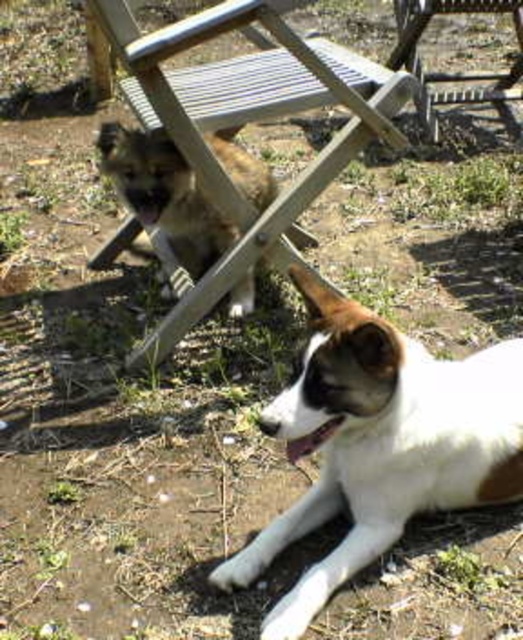
Which is behind, point (497, 445) or point (424, 128)?

The point (424, 128) is behind.

Locate an element on the screen. The height and width of the screenshot is (640, 523). white fur dog at lower right is located at coordinates (380, 444).

Who is more forward, [283,102] or [211,144]?

Positioned in front is point [283,102].

Which is above, wooden at upper center or brown fur dog at center?

Positioned higher is wooden at upper center.

Does point (132, 97) come closer to viewer compared to point (240, 298)?

Yes, point (132, 97) is in front of point (240, 298).

You are a GUI agent. You are given a task and a screenshot of the screen. Output one action in this format:
    pyautogui.click(x=<x>, y=<y>)
    Task: Click on the wooden at upper center
    
    Given the screenshot: What is the action you would take?
    (x=247, y=118)

Between white fur dog at lower right and wooden at upper center, which one appears on the right side from the viewer's perspective?

white fur dog at lower right is more to the right.

Where is `white fur dog at lower right`? The width and height of the screenshot is (523, 640). white fur dog at lower right is located at coordinates (380, 444).